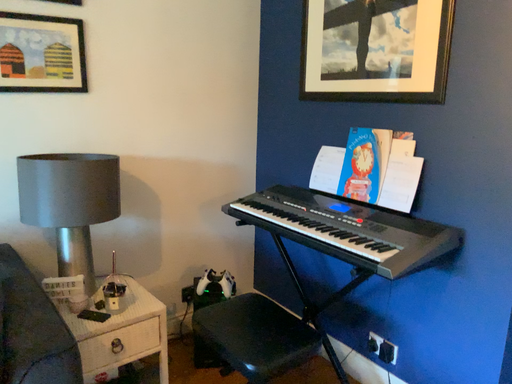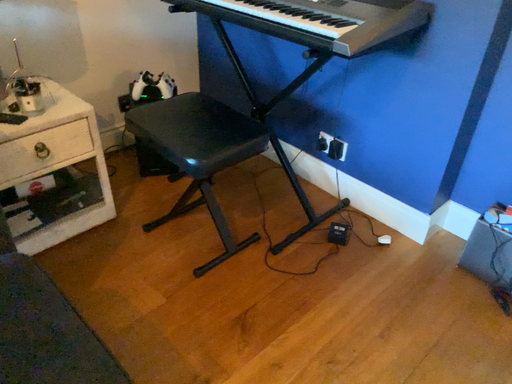
Question: How did the camera likely rotate when shooting the video?

Choices:
 (A) rotated downward
 (B) rotated upward

Answer: (A)